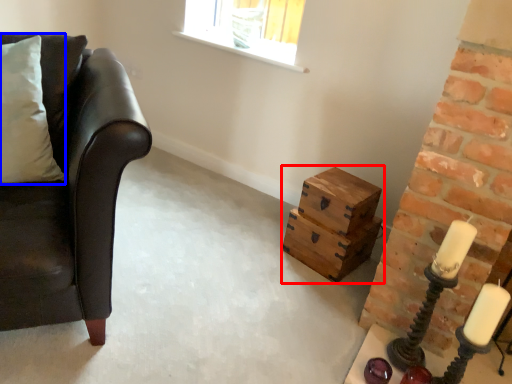
Question: Which point is closer to the camera, crate (highlighted by a red box) or pillow (highlighted by a blue box)?

Choices:
 (A) crate
 (B) pillow

Answer: (B)